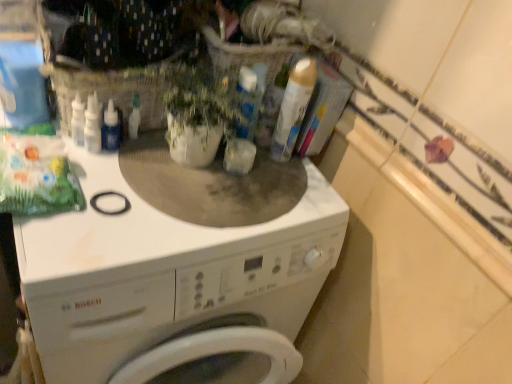
At what (x,y) coordinates should I click in order to perform the action: click on vacant region above white matte washing machine at center (from a real-world perspective). Please return your answer as a coordinate pair (x, y). Looking at the image, I should click on (183, 200).